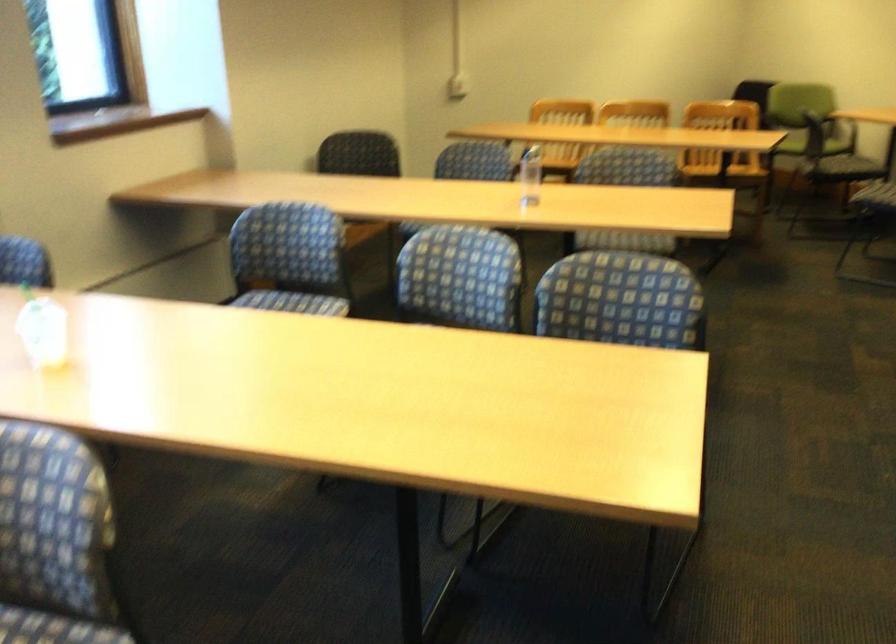
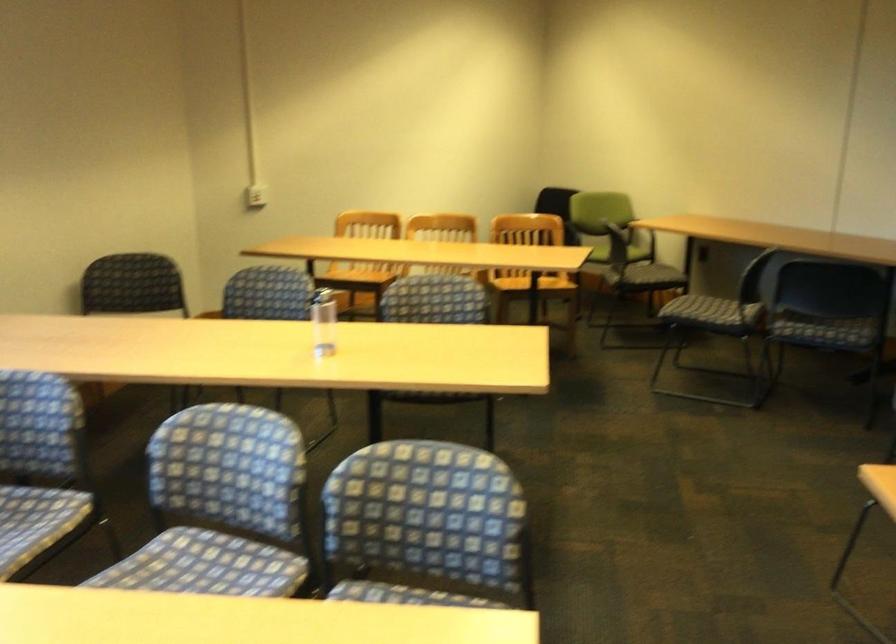
Find the pixel in the second image that matches [616,315] in the first image.

(425, 527)